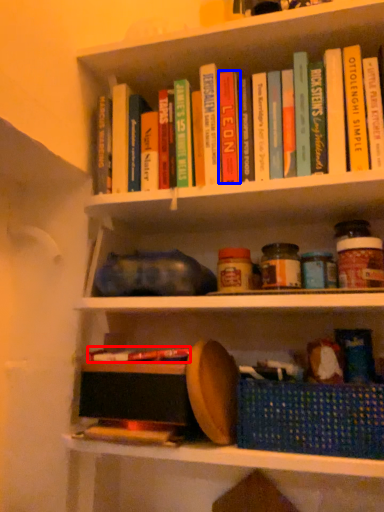
Question: Which object appears closest to the camera in this image, book (highlighted by a red box) or paperback book (highlighted by a blue box)?

Choices:
 (A) book
 (B) paperback book

Answer: (A)